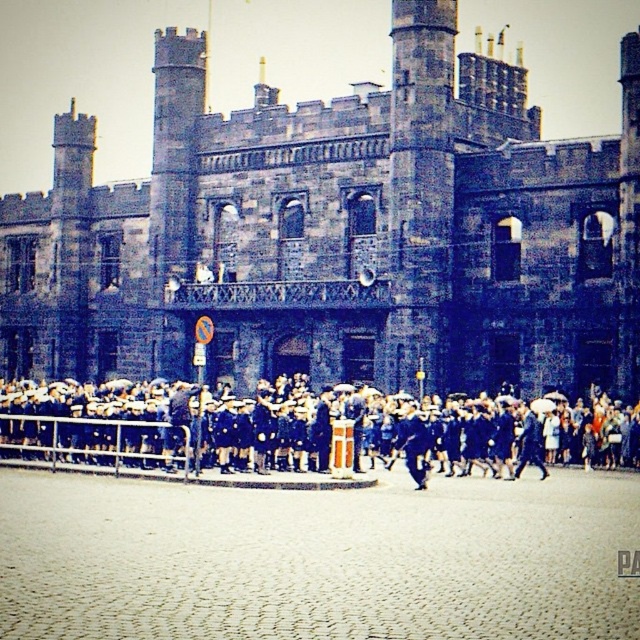
This screenshot has height=640, width=640. Describe the element at coordinates (339, 232) in the screenshot. I see `dark stone castle at center` at that location.

Is dark stone castle at center thinner than dark blue uniforms at center?

No, dark stone castle at center is not thinner than dark blue uniforms at center.

Which is behind, point (577, 140) or point (269, 419)?

The point (577, 140) is more distant.

Find the location of a particular element. The image size is (640, 640). dark stone castle at center is located at coordinates (339, 232).